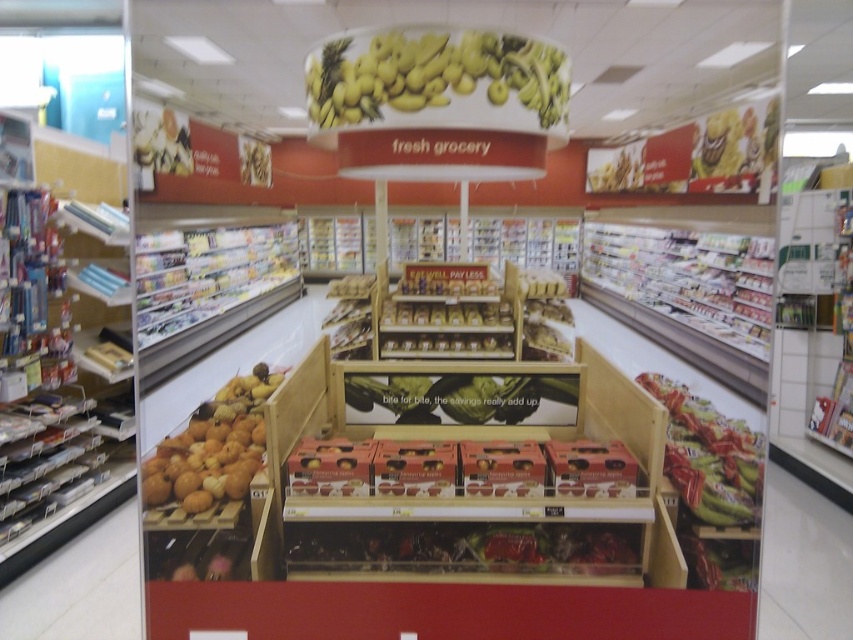
You are a customer in the grocery store and want to grab both the green matte leaf at center and the shiny red bag at right. Which item should you reach for first to get the one closer to you?

The green matte leaf at center is closer to you, so you should reach for it first before the shiny red bag at right.

You are a customer looking at the shiny plastic berries at center and the green matte leaf at center in the Fresh Grocery section. Which object is positioned to the left?

The shiny plastic berries at center are to the left of the green matte leaf at center.

You are a customer in the Fresh Grocery section. You see the yellow matte bananas at upper center and the shiny red bag at right. Which item is larger in size?

The yellow matte bananas at upper center is smaller than the shiny red bag at right, so the shiny red bag at right is larger in size.